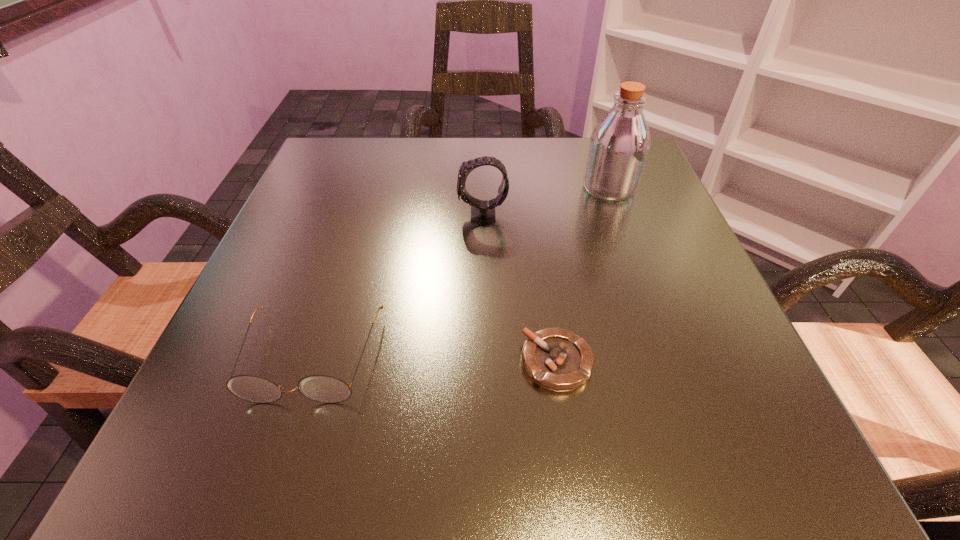
The image size is (960, 540). In the image, there is a desktop. Find the location of `vacant space at the right edge`. vacant space at the right edge is located at coordinates (690, 334).

Locate an element on the screen. The image size is (960, 540). unoccupied area between the spectacles and the rightmost object is located at coordinates (461, 273).

The height and width of the screenshot is (540, 960). What are the coordinates of `vacant space that's between the second shortest object and the third shortest object` in the screenshot? It's located at (397, 286).

This screenshot has height=540, width=960. I want to click on empty location between the ashtray and the third nearest object, so click(519, 288).

Locate an element on the screen. vacant area that lies between the watch and the rightmost object is located at coordinates (546, 201).

Locate an element on the screen. Image resolution: width=960 pixels, height=540 pixels. free space between the second tallest object and the bottle is located at coordinates (546, 201).

Where is `unoccupied position between the bottle and the ashtray`? The height and width of the screenshot is (540, 960). unoccupied position between the bottle and the ashtray is located at coordinates tap(583, 275).

Locate an element on the screen. This screenshot has width=960, height=540. free spot between the second shortest object and the shortest object is located at coordinates [434, 360].

You are a GUI agent. You are given a task and a screenshot of the screen. Output one action in this format:
    pyautogui.click(x=<x>, y=<y>)
    Task: Click on the unoccupied position between the spectacles and the tallest object
    
    Given the screenshot: What is the action you would take?
    pyautogui.click(x=461, y=273)

Find the location of a particular element. free space between the ashtray and the spectacles is located at coordinates (434, 360).